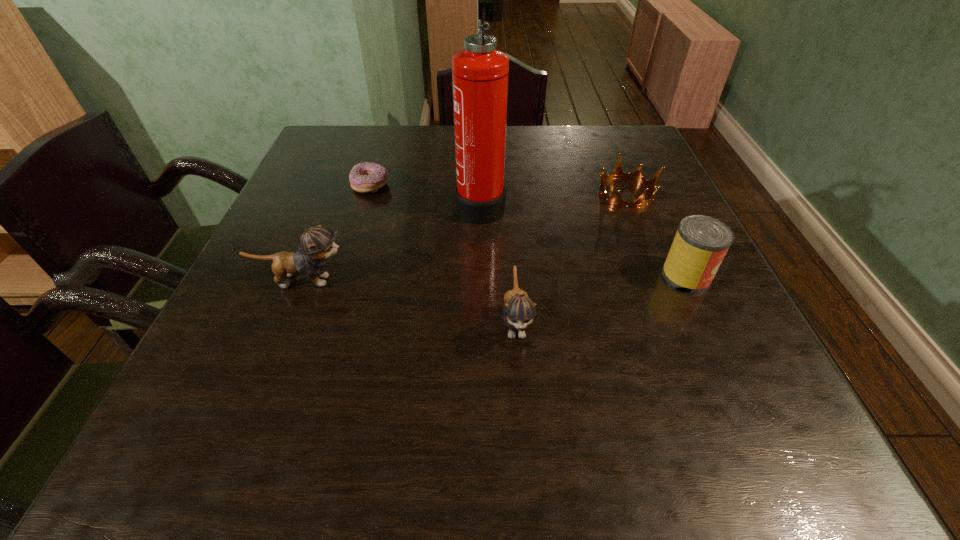
This screenshot has height=540, width=960. In order to click on empty space that is in between the taller kitten and the fifth tallest object in this screenshot , I will do `click(465, 237)`.

At what (x,y) coordinates should I click in order to perform the action: click on free space between the taller kitten and the fire extinguisher. Please return your answer as a coordinate pair (x, y). This screenshot has height=540, width=960. Looking at the image, I should click on (392, 242).

The width and height of the screenshot is (960, 540). Find the location of `object that ranks as the second closest to the doughnut`. object that ranks as the second closest to the doughnut is located at coordinates (317, 244).

I want to click on object that ranks as the closest to the taller kitten, so click(480, 72).

In order to click on vacant space that satisfies the following two spatial constraints: 1. on the front-facing side of the tallest object; 2. on the back side of the can in this screenshot , I will do `click(480, 276)`.

Identify the location of free space that satisfies the following two spatial constraints: 1. on the front-facing side of the can; 2. on the right side of the fire extinguisher. Image resolution: width=960 pixels, height=540 pixels. (480, 276).

You are a GUI agent. You are given a task and a screenshot of the screen. Output one action in this format:
    pyautogui.click(x=<x>, y=<y>)
    Task: Click on the free space that satisfies the following two spatial constraints: 1. on the front side of the doughnut; 2. on the left side of the crown
    
    Given the screenshot: What is the action you would take?
    pyautogui.click(x=369, y=193)